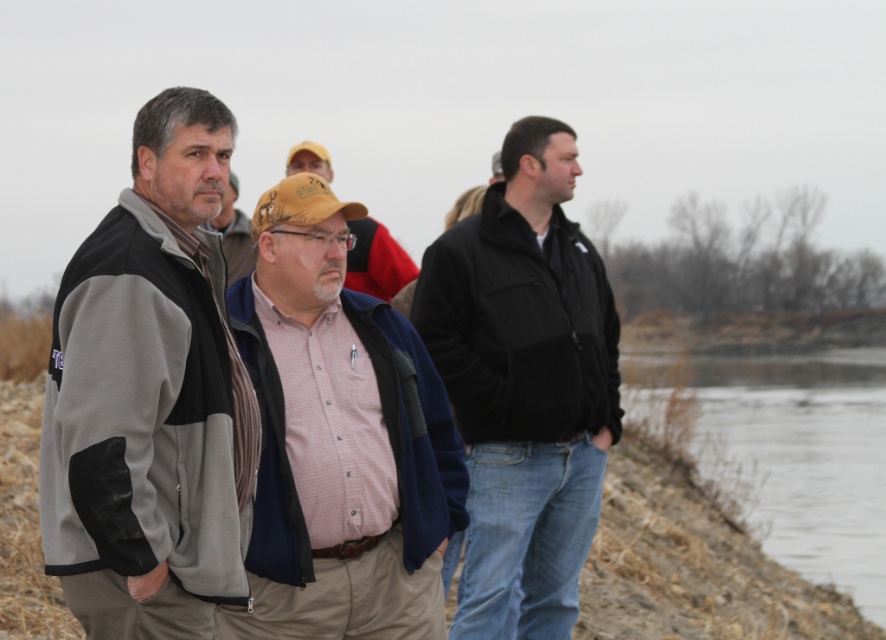
Question: Which point appears farthest from the camera in this image?

Choices:
 (A) (241, 269)
 (B) (781, 404)
 (C) (377, 236)

Answer: (B)

Question: Considering the relative positions of black fleece jacket at center and brown dirt at lower right in the image provided, where is black fleece jacket at center located with respect to brown dirt at lower right?

Choices:
 (A) right
 (B) left

Answer: (B)

Question: Which of the following is the closest to the observer?

Choices:
 (A) (228, 273)
 (B) (387, 476)
 (C) (294, 147)
 (D) (131, 419)

Answer: (D)

Question: Is black fleece jacket at center below brown fabric cap at center?

Choices:
 (A) yes
 (B) no

Answer: (A)

Question: Which point is farther to the camera?

Choices:
 (A) brown fabric cap at center
 (B) matte black jacket at center

Answer: (B)

Question: Can you confirm if black fleece jacket at center is positioned to the left of brown dirt at lower right?

Choices:
 (A) no
 (B) yes

Answer: (B)